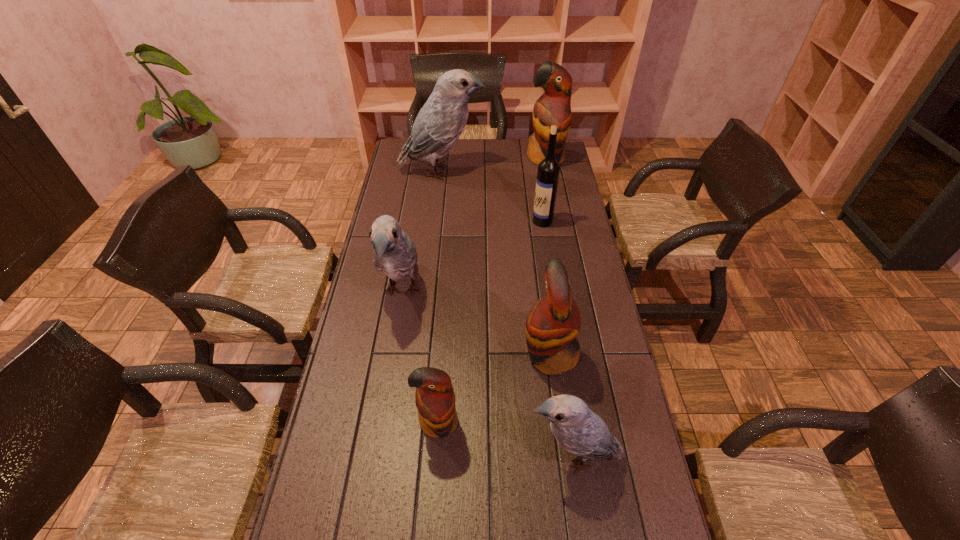
The width and height of the screenshot is (960, 540). Identify the location of the farthest gray parrot. (440, 122).

Locate an element on the screen. the farthest red parrot is located at coordinates (553, 107).

Identify the location of the third farthest object. (548, 172).

The width and height of the screenshot is (960, 540). Find the location of `wine bottle`. wine bottle is located at coordinates (548, 172).

Locate an element on the screen. the third nearest object is located at coordinates (553, 323).

Locate an element on the screen. the second smallest red parrot is located at coordinates (553, 323).

You are a GUI agent. You are given a task and a screenshot of the screen. Output one action in this format:
    pyautogui.click(x=<x>, y=<y>)
    Task: Click on the fourth farthest object
    
    Given the screenshot: What is the action you would take?
    pyautogui.click(x=395, y=255)

Identify the location of the second nearest gray parrot. (395, 255).

Where is `the rightmost gray parrot`? the rightmost gray parrot is located at coordinates point(578,430).

Locate an element on the screen. the nearest gray parrot is located at coordinates (578, 430).